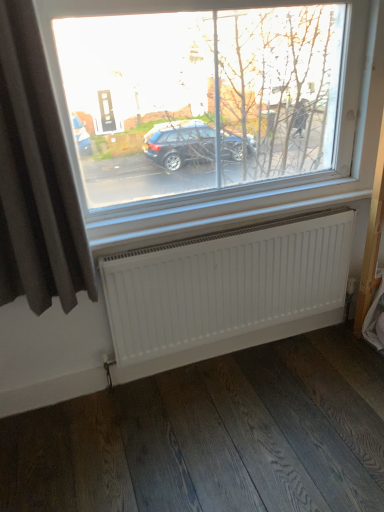
You are a GUI agent. You are given a task and a screenshot of the screen. Output one action in this format:
    pyautogui.click(x=<x>, y=<y>)
    Task: Click on the vacant area situated below dark grey fabric curtain at left (from a real-world perspective)
    This screenshot has height=512, width=384.
    Given the screenshot: What is the action you would take?
    [67, 410]